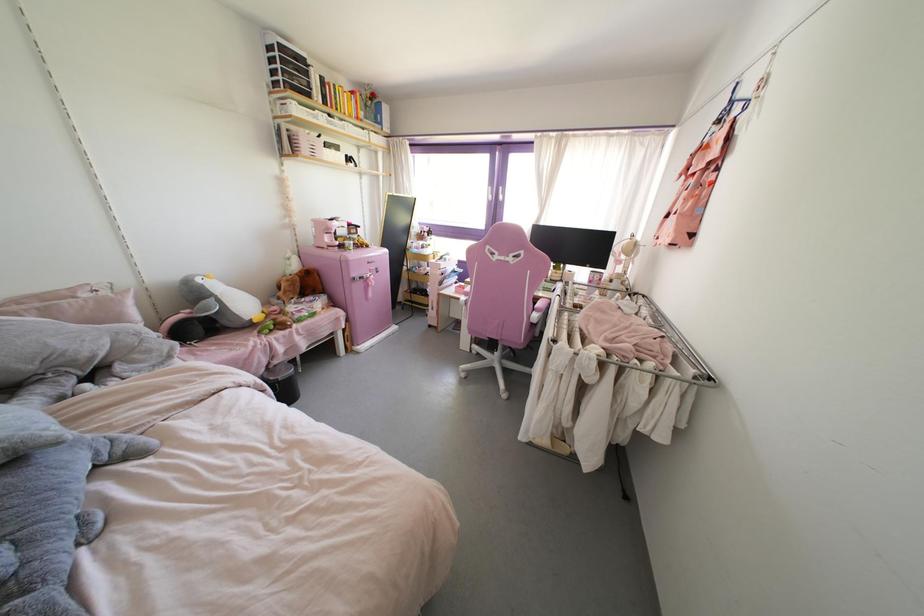
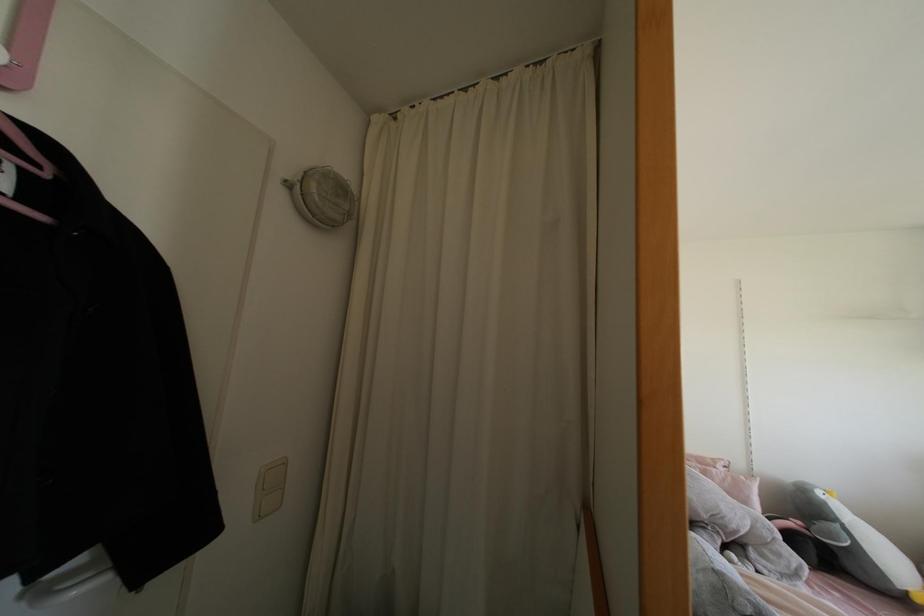
Find the pixel in the second image that matches pixel 199 280 in the first image.

(819, 493)